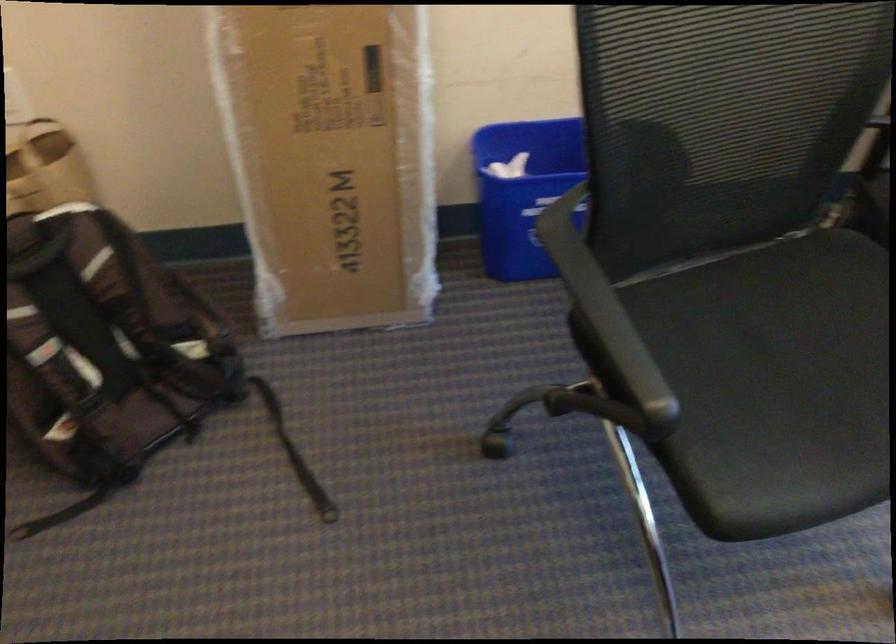
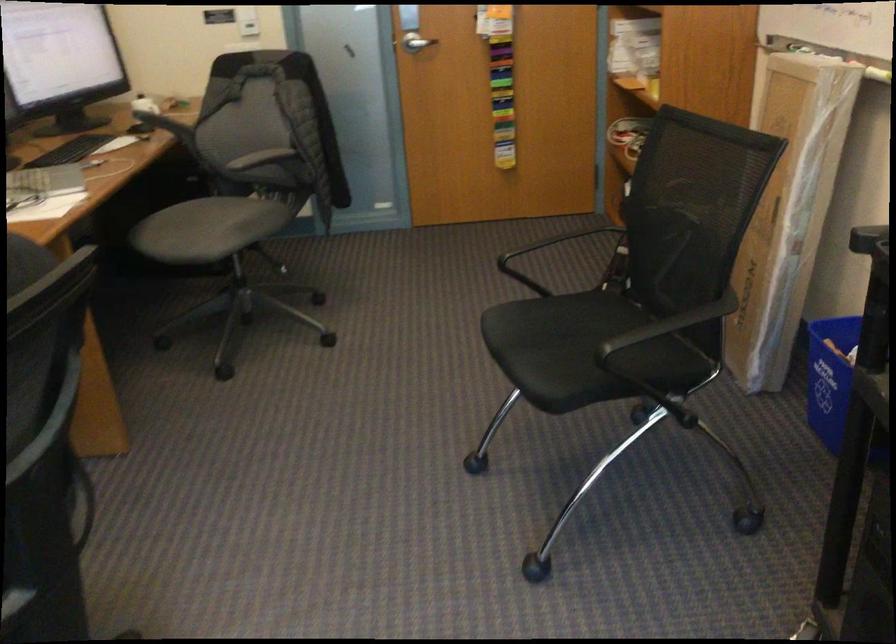
Find the pixel in the second image that matches (787,353) in the first image.

(583, 351)